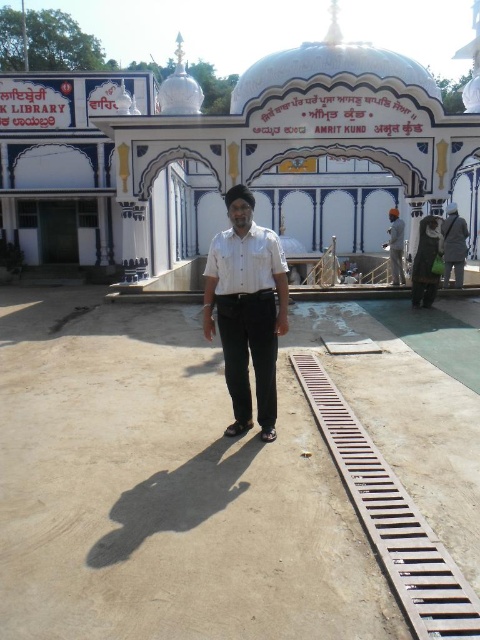
The image size is (480, 640). Find the location of `brown metal train track at lower right`. brown metal train track at lower right is located at coordinates pyautogui.click(x=391, y=516).

Who is more forward, (444, 630) or (431, 285)?

Positioned in front is point (444, 630).

Measure the distance between brown metal train track at lower right and camera.

The distance of brown metal train track at lower right from camera is 4.54 meters.

The height and width of the screenshot is (640, 480). Identify the location of brown metal train track at lower right. (391, 516).

Can you confirm if brown metal train track at lower right is positioned to the left of white fabric uniform at lower right?

Indeed, brown metal train track at lower right is positioned on the left side of white fabric uniform at lower right.

Is brown metal train track at lower right in front of white fabric uniform at lower right?

Yes, brown metal train track at lower right is in front of white fabric uniform at lower right.

Find the location of a particular element. The height and width of the screenshot is (640, 480). brown metal train track at lower right is located at coordinates (391, 516).

Is point (454, 632) closer to viewer compared to point (462, 269)?

Yes, point (454, 632) is closer to viewer.

Is brown metal train track at lower right taller than dark gray fabric uniform at right?

In fact, brown metal train track at lower right may be shorter than dark gray fabric uniform at right.

This screenshot has height=640, width=480. In order to click on brown metal train track at lower right in this screenshot , I will do `click(391, 516)`.